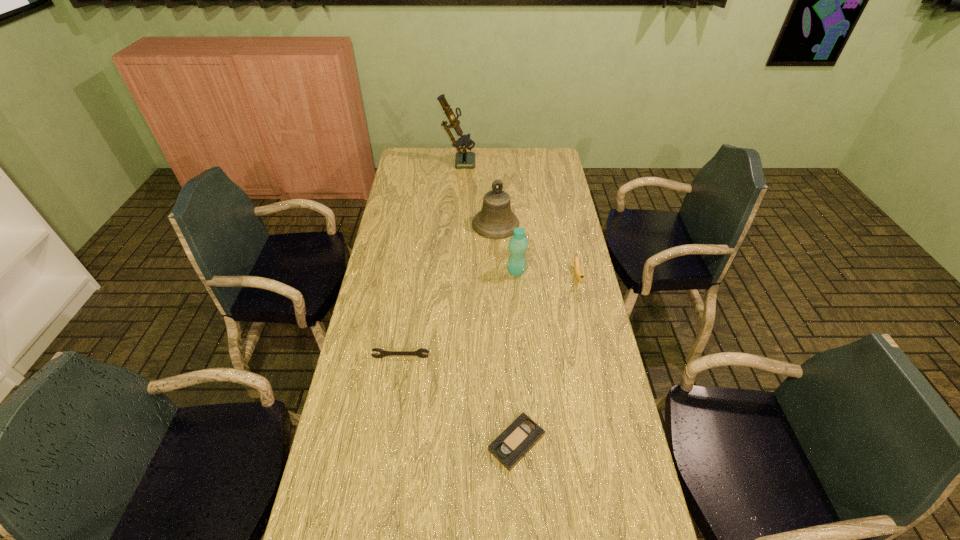
I want to click on free space that satisfies the following two spatial constraints: 1. at the eyepiece of the microscope; 2. on the left side of the fifth nearest object, so click(454, 224).

Locate an element on the screen. free space that satisfies the following two spatial constraints: 1. at the eyepiece of the farthest object; 2. on the back side of the nearest object is located at coordinates (440, 443).